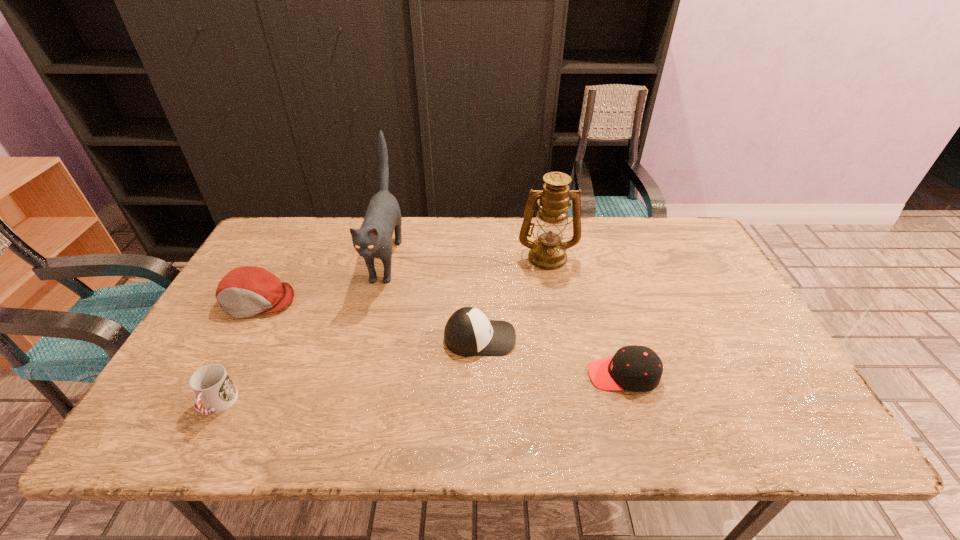
The image size is (960, 540). I want to click on cat, so click(383, 216).

I want to click on oil lamp, so click(548, 252).

Locate an element on the screen. the leftmost cap is located at coordinates (246, 291).

The width and height of the screenshot is (960, 540). I want to click on the third object from right to left, so click(468, 332).

I want to click on cup, so click(212, 385).

I want to click on the rightmost cap, so click(634, 368).

Identify the location of vacant space located 0.120m at the face of the cat. This screenshot has width=960, height=540. (366, 336).

Locate an element on the screen. vacant space located on the right of the oil lamp is located at coordinates (694, 256).

You are a GUI agent. You are given a task and a screenshot of the screen. Output one action in this format:
    pyautogui.click(x=<x>, y=<y>)
    Task: Click on the vacant space located on the front-facing side of the leftmost cap
    This screenshot has height=540, width=960.
    Given the screenshot: What is the action you would take?
    pyautogui.click(x=223, y=366)

Locate an element on the screen. vacant space situated 0.330m on the front panel of the third object from right to left is located at coordinates (643, 338).